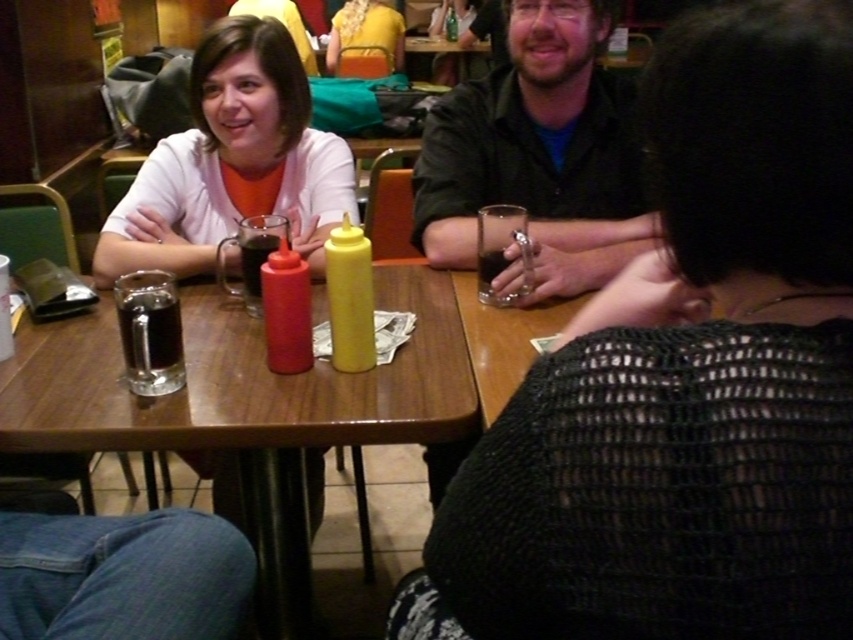
Question: Does wooden table at center have a greater width compared to dark brown liquid at center?

Choices:
 (A) no
 (B) yes

Answer: (B)

Question: Is knitted black sweater at center bigger than yellow fabric shirt at center?

Choices:
 (A) yes
 (B) no

Answer: (B)

Question: Which object is closer to the camera taking this photo?

Choices:
 (A) dark matte glass at center
 (B) wooden table at center

Answer: (B)

Question: Observing the image, what is the correct spatial positioning of yellow fabric shirt at center in reference to dark brown liquid at center?

Choices:
 (A) above
 (B) below

Answer: (A)

Question: Estimate the real-world distances between objects in this image. Which object is farther from the dark brown liquid at center?

Choices:
 (A) matte black shirt at center
 (B) wooden table at center
 (C) knitted black sweater at center

Answer: (C)

Question: Which point is farther from the camera taking this photo?

Choices:
 (A) (827, 636)
 (B) (380, 44)
 (C) (254, 237)
 (D) (489, 284)

Answer: (B)